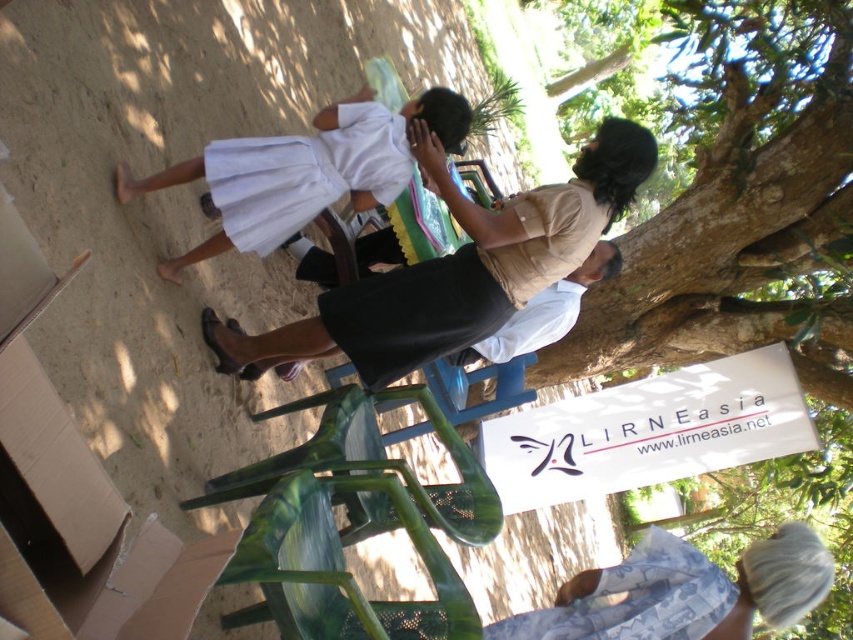
Question: Is white paper sign at center to the left of white fabric skirt at left from the viewer's perspective?

Choices:
 (A) no
 (B) yes

Answer: (A)

Question: Which point is farther to the camera?

Choices:
 (A) white cotton dress at center
 (B) white paper sign at center

Answer: (B)

Question: Is white paper sign at center in front of white fabric skirt at left?

Choices:
 (A) yes
 (B) no

Answer: (B)

Question: Which point appears farthest from the camera in this image?

Choices:
 (A) (759, 406)
 (B) (669, 609)
 (C) (421, 115)

Answer: (A)

Question: Can you confirm if matte beige blouse at upper center is positioned above blue printed fabric at lower right?

Choices:
 (A) yes
 (B) no

Answer: (A)

Question: Which point is closer to the camera taking this photo?

Choices:
 (A) (380, 115)
 (B) (439, 280)
 (C) (808, 422)

Answer: (B)